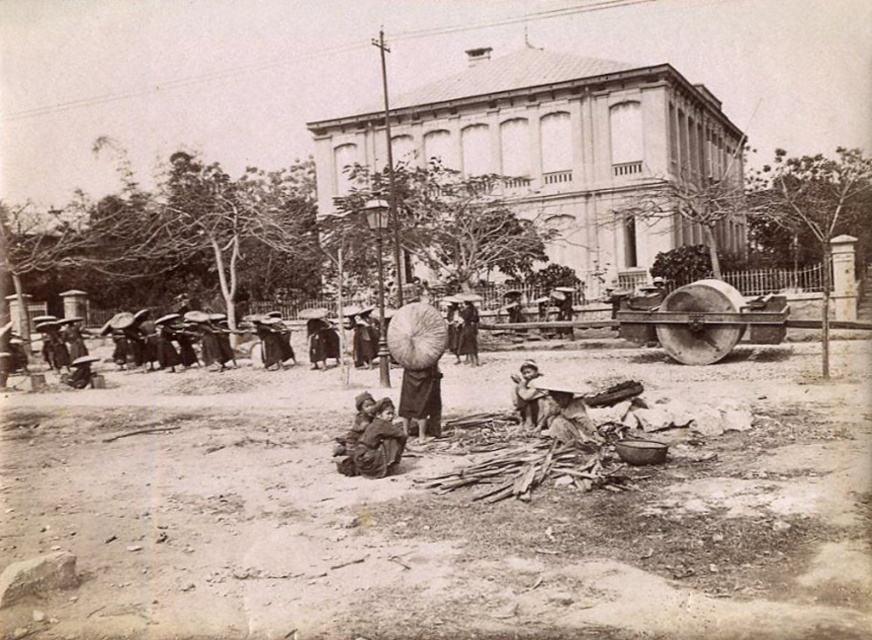
Can you confirm if brown woven basket at lower center is shorter than brown fabric child at center?

Indeed, brown woven basket at lower center has a lesser height compared to brown fabric child at center.

Where is `brown woven basket at lower center`? The image size is (872, 640). brown woven basket at lower center is located at coordinates (566, 416).

This screenshot has width=872, height=640. Find the location of `brown woven basket at lower center`. brown woven basket at lower center is located at coordinates coord(566,416).

Can you confirm if dirt field at lower center is taller than brown fabric children at center?

Yes.

Who is shorter, dirt field at lower center or brown fabric children at center?

brown fabric children at center is shorter.

Identify the location of dirt field at lower center. (439, 513).

Between brown fabric children at center and brown woven basket at lower center, which one has more height?

brown fabric children at center

Is brown fabric children at center wider than brown woven basket at lower center?

No.

Is point (366, 465) farther from viewer compared to point (571, 406)?

No, (366, 465) is closer to viewer.

The height and width of the screenshot is (640, 872). In order to click on brown fabric children at center in this screenshot , I will do `click(378, 442)`.